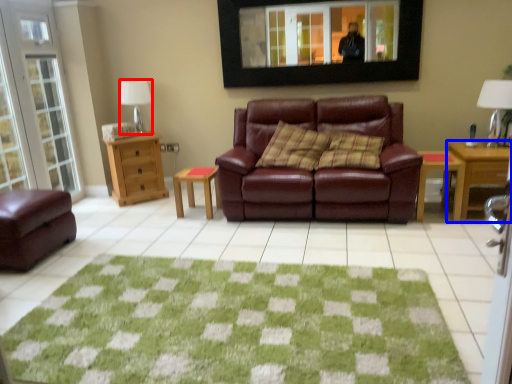
Question: Which object is further to the camera taking this photo, lamp (highlighted by a red box) or desk (highlighted by a blue box)?

Choices:
 (A) lamp
 (B) desk

Answer: (A)